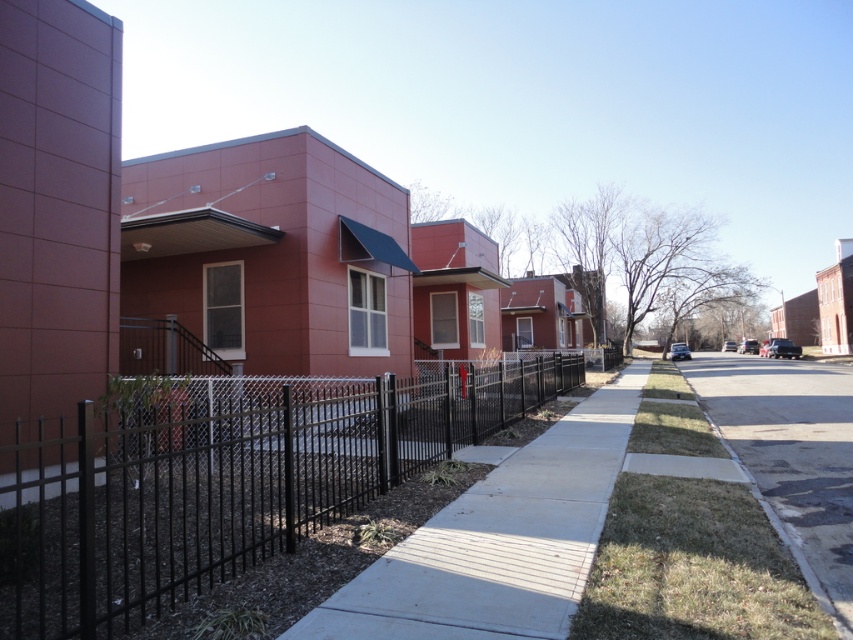
You are a GUI agent. You are given a task and a screenshot of the screen. Output one action in this format:
    pyautogui.click(x=<x>, y=<y>)
    Task: Click on the smooth concrete sidewalk at center
    This screenshot has height=640, width=853.
    Given the screenshot: What is the action you would take?
    click(498, 541)

Between point (584, 442) and point (750, 458), which one is positioned in front?

Point (750, 458) is more forward.

Between point (579, 433) and point (850, 515), which one is positioned in front?

Point (850, 515) is in front.

Where is `smooth concrete sidewalk at center`? The image size is (853, 640). smooth concrete sidewalk at center is located at coordinates (498, 541).

Is black metal fence at center taller than asphalt pavement at lower right?

Indeed, black metal fence at center has a greater height compared to asphalt pavement at lower right.

Is black metal fence at center to the left of asphalt pavement at lower right from the viewer's perspective?

Correct, you'll find black metal fence at center to the left of asphalt pavement at lower right.

Is point (86, 426) closer to camera compared to point (845, 426)?

Yes, point (86, 426) is in front of point (845, 426).

Locate an element on the screen. The width and height of the screenshot is (853, 640). black metal fence at center is located at coordinates (225, 484).

Between black metal fence at center and smooth concrete sidewalk at center, which one is positioned lower?

smooth concrete sidewalk at center

Between black metal fence at center and smooth concrete sidewalk at center, which one appears on the left side from the viewer's perspective?

black metal fence at center is more to the left.

This screenshot has height=640, width=853. I want to click on black metal fence at center, so click(x=225, y=484).

This screenshot has height=640, width=853. What are the coordinates of `black metal fence at center` in the screenshot? It's located at (225, 484).